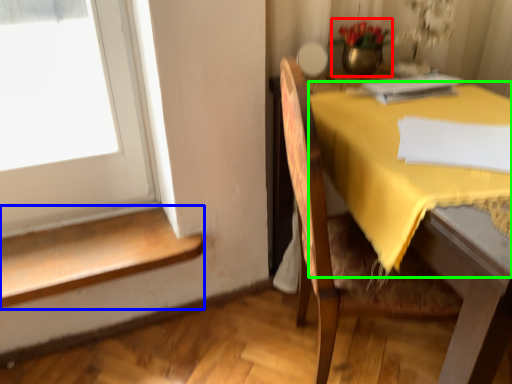
Question: Which is nearer to the floral arrangement (highlighted by a red box)? stairwell (highlighted by a blue box) or tablecloth (highlighted by a green box).

Choices:
 (A) stairwell
 (B) tablecloth

Answer: (B)